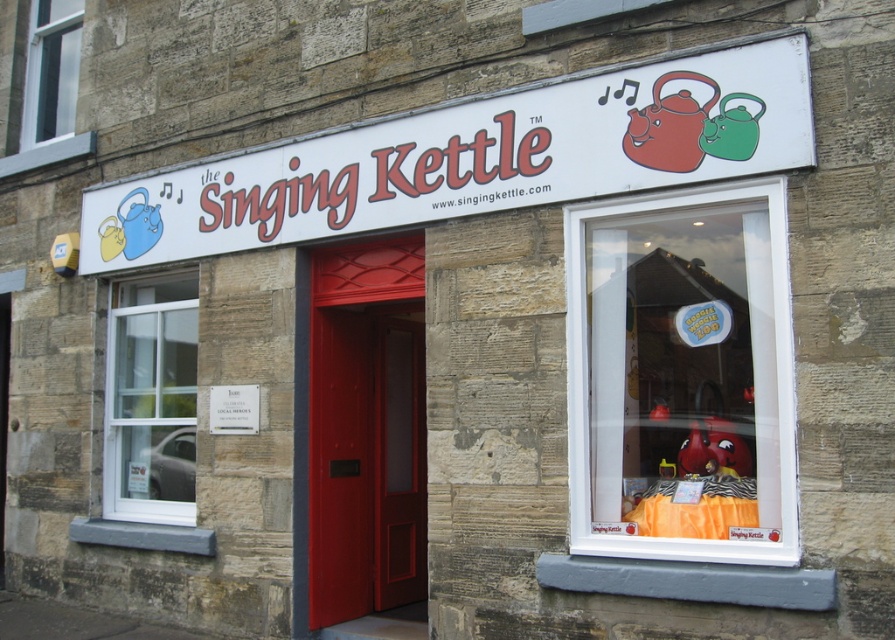
Question: Which is nearer to the white glass window at lower left?

Choices:
 (A) white plastic sign at upper center
 (B) white plastic window at upper left
 (C) blue rubber tea pot at upper left

Answer: (C)

Question: Considering the relative positions of white glass window at lower left and white plastic window at upper left in the image provided, where is white glass window at lower left located with respect to white plastic window at upper left?

Choices:
 (A) left
 (B) right

Answer: (B)

Question: Which of the following is the farthest from the observer?

Choices:
 (A) white glass window at lower left
 (B) green matte tea pot at upper right
 (C) white plastic sign at upper center

Answer: (A)

Question: Among these points, which one is nearest to the camera?

Choices:
 (A) (103, 259)
 (B) (726, 96)
 (C) (116, 328)
 (D) (638, 129)

Answer: (B)

Question: Can you confirm if matte plastic kettle at center is positioned to the left of white plastic window at upper left?

Choices:
 (A) no
 (B) yes

Answer: (A)

Question: Is white plastic window at upper left wider than matte red teapot at upper center?

Choices:
 (A) no
 (B) yes

Answer: (B)